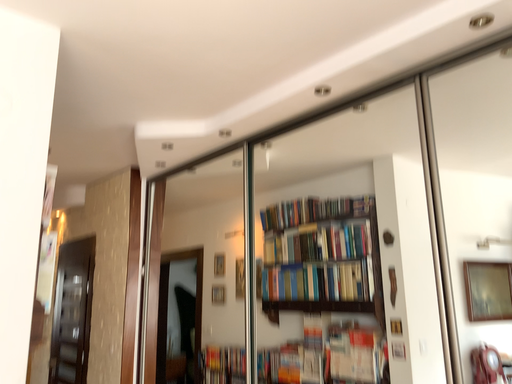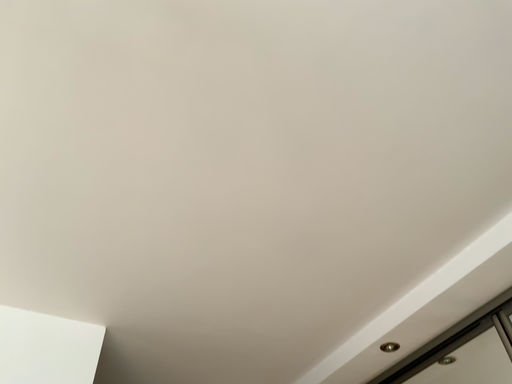
Question: How did the camera likely rotate when shooting the video?

Choices:
 (A) rotated left
 (B) rotated right

Answer: (A)